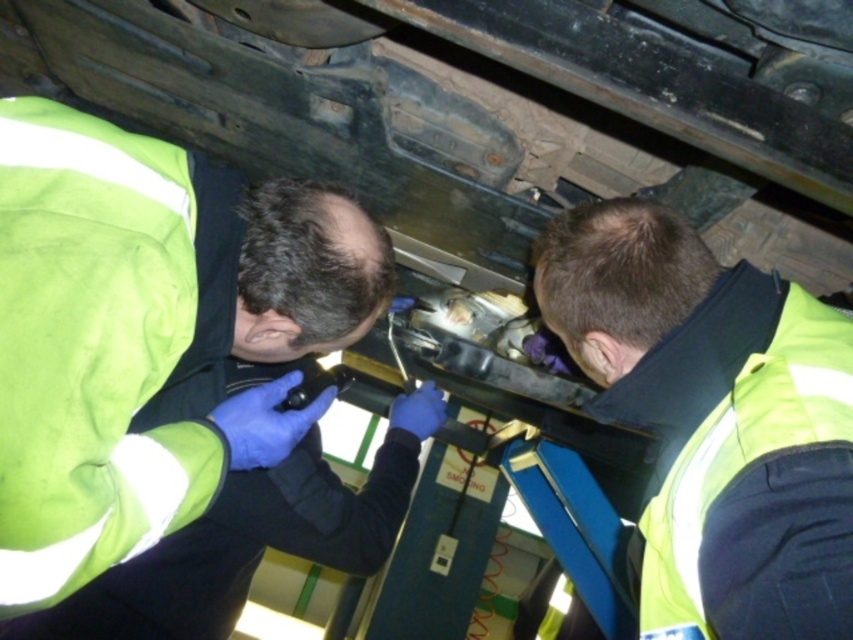
Question: Can you confirm if green reflective vest at center is wider than yellow reflective vest at lower right?

Choices:
 (A) yes
 (B) no

Answer: (A)

Question: Is green reflective vest at center closer to the viewer compared to yellow reflective vest at lower right?

Choices:
 (A) yes
 (B) no

Answer: (B)

Question: Is green reflective vest at center in front of yellow reflective vest at lower right?

Choices:
 (A) no
 (B) yes

Answer: (A)

Question: Which point is closer to the camera?

Choices:
 (A) (712, 339)
 (B) (306, 240)

Answer: (A)

Question: Which of the following is the closest to the observer?

Choices:
 (A) green reflective vest at center
 (B) yellow reflective vest at lower right

Answer: (B)